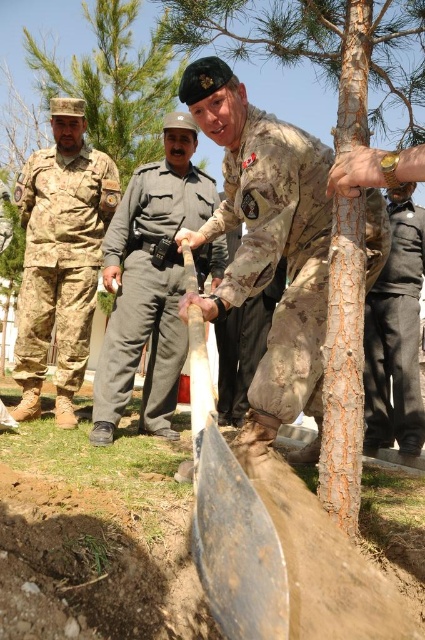
You are a drone operator trying to capture a photo of the tree planting activity. You need to ensure that both the point at coordinates point (376, 68) and point (184, 248) are clearly visible in the frame. Based on their positions, which point is closer to the camera?

Point (376, 68) is in front of point (184, 248), so it is closer to the camera.

You are organizing a military exercise and need to determine clothing sizes. Based on the image, which clothing item has a greater width between the camouflage fabric uniform at left and the dark gray cotton pants at center?

The camouflage fabric uniform at left has a greater width than the dark gray cotton pants at center according to the description.

Based on the scene description, which object is bigger in size between the rough bark tree at center and the camouflage fabric uniform at left?

The rough bark tree at center is larger in size compared to the camouflage fabric uniform at left.